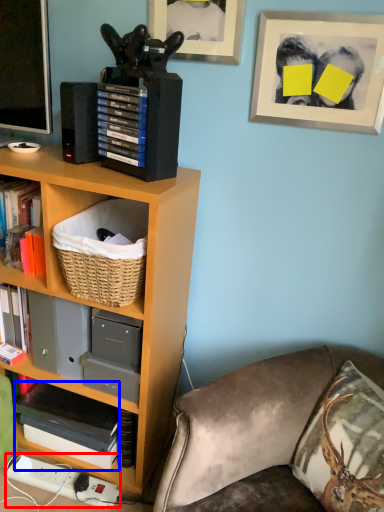
Question: Which object is further to the camera taking this photo, plug (highlighted by a red box) or paperback book (highlighted by a blue box)?

Choices:
 (A) plug
 (B) paperback book

Answer: (A)